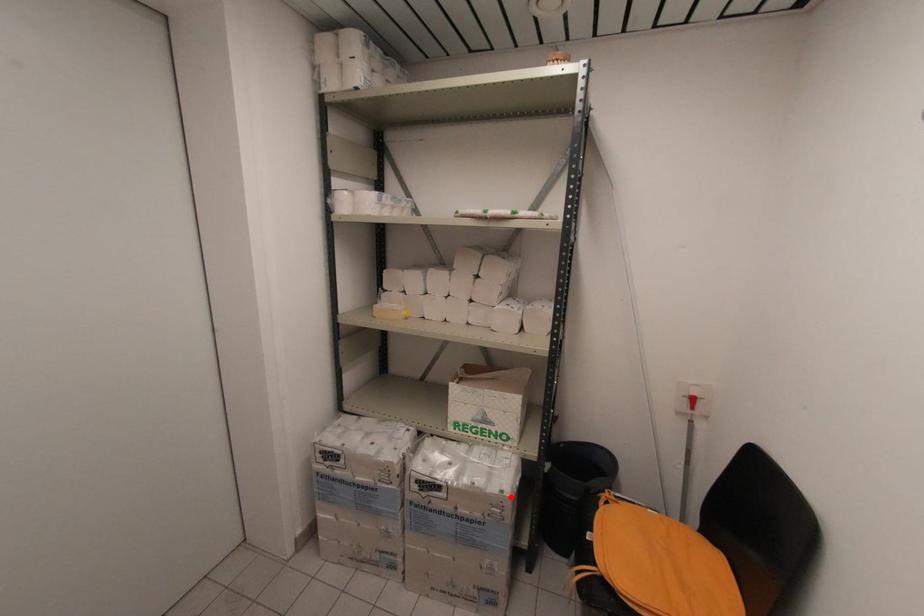
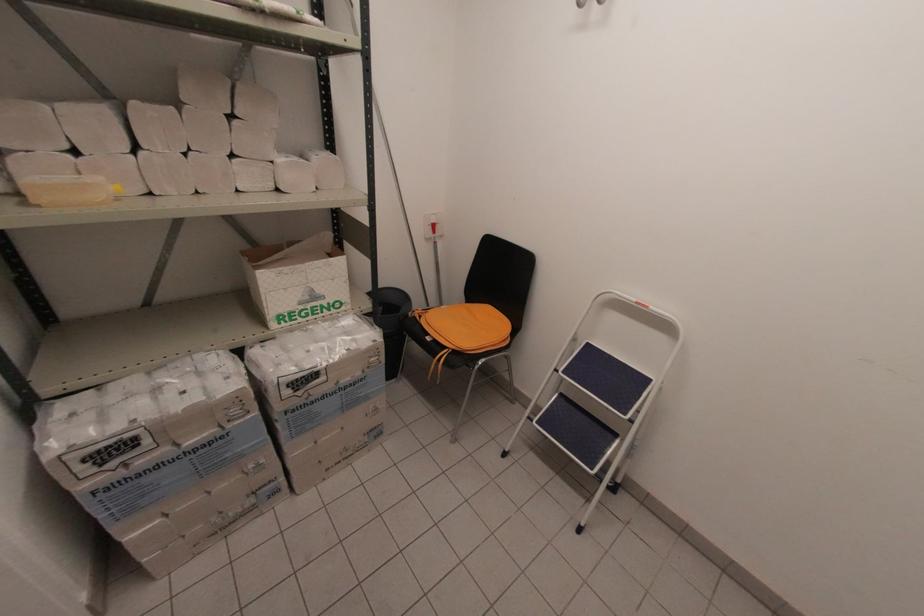
The point at the highlighted location is marked in the first image. Where is the corresponding point in the second image?

(383, 341)